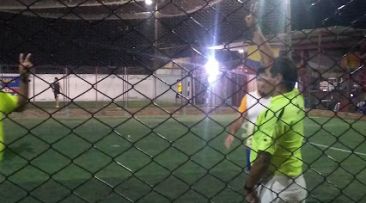
Locate an element on the screen. This screenshot has height=203, width=366. light is located at coordinates (215, 66).